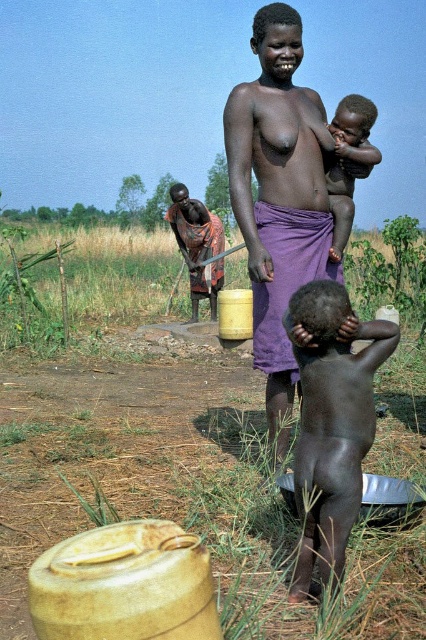
Between dark skin baby at center and brown woven cloth at center, which one is positioned lower?

dark skin baby at center is below.

Which of these two, dark skin baby at center or brown woven cloth at center, stands shorter?

With less height is brown woven cloth at center.

Is point (336, 410) closer to camera compared to point (187, 220)?

Yes, point (336, 410) is closer to viewer.

Locate an element on the screen. The width and height of the screenshot is (426, 640). dark skin baby at center is located at coordinates (331, 419).

Is matte purple cloth at center to the left of dark skin baby at upper center from the viewer's perspective?

Yes, matte purple cloth at center is to the left of dark skin baby at upper center.

Identify the location of matte purple cloth at center. [278, 196].

Is matte purple cloth at center wider than brown woven cloth at center?

In fact, matte purple cloth at center might be narrower than brown woven cloth at center.

At what (x,y) coordinates should I click in order to perform the action: click on matte purple cloth at center. Please return your answer as a coordinate pair (x, y). Looking at the image, I should click on (278, 196).